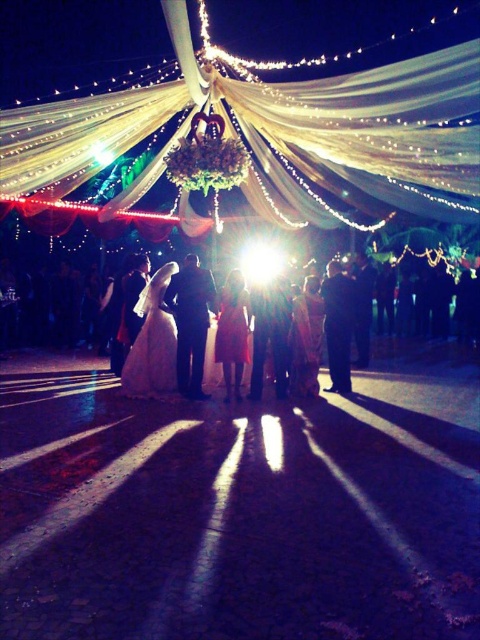
Which is in front, point (309, 96) or point (142, 316)?

Point (309, 96)

The width and height of the screenshot is (480, 640). Find the location of `illuminated sheer fabric canopy at upper center`. illuminated sheer fabric canopy at upper center is located at coordinates [273, 134].